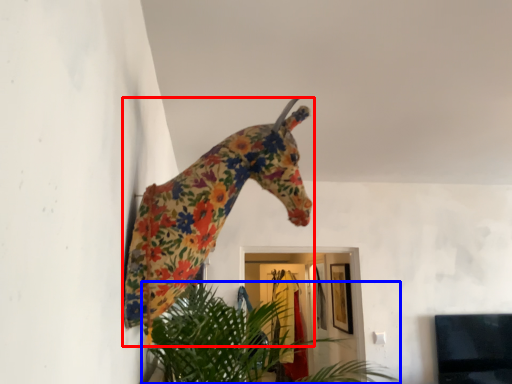
Question: Which object is closer to the camera taking this photo, giraffe (highlighted by a red box) or houseplant (highlighted by a blue box)?

Choices:
 (A) giraffe
 (B) houseplant

Answer: (A)